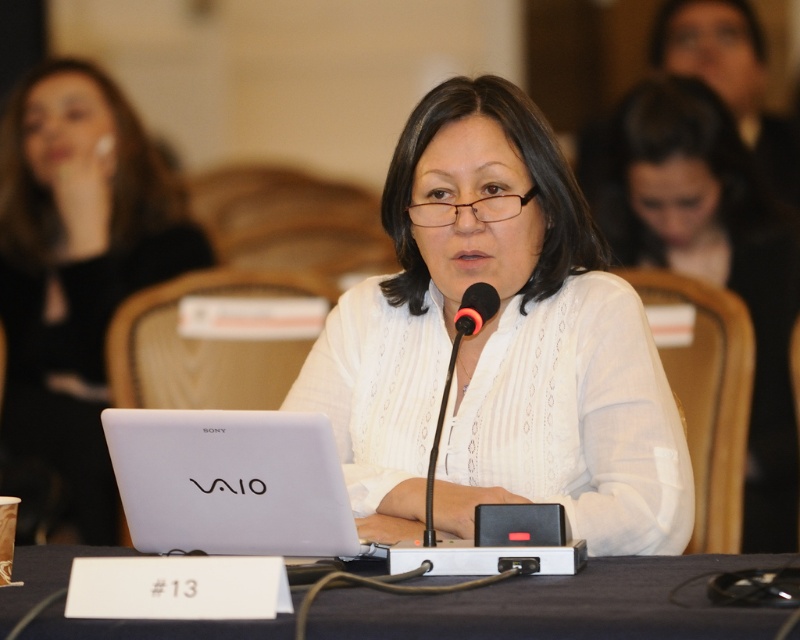
Question: Can you confirm if black plastic table at center is positioned to the left of black matte microphone at center?

Choices:
 (A) yes
 (B) no

Answer: (A)

Question: Does matte white laptop at center appear over black plastic table at center?

Choices:
 (A) no
 (B) yes

Answer: (B)

Question: Among these points, which one is nearest to the camera?

Choices:
 (A) (232, 509)
 (B) (641, 138)

Answer: (A)

Question: Which of the following is the farthest from the observer?

Choices:
 (A) (638, 120)
 (B) (72, 298)

Answer: (A)

Question: Is white lace shirt at center to the left of matte white laptop at center from the viewer's perspective?

Choices:
 (A) no
 (B) yes

Answer: (A)

Question: Which of the following is the farthest from the observer?

Choices:
 (A) matte white laptop at center
 (B) black plastic microphone at center
 (C) black matte microphone at center
 (D) black plastic table at center

Answer: (A)